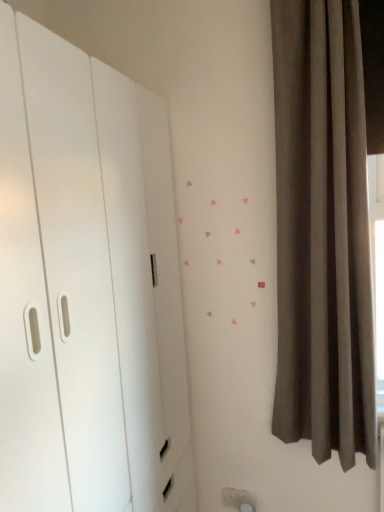
Question: Is white matte dresser at left taller than dark gray velvet curtain at right?

Choices:
 (A) yes
 (B) no

Answer: (A)

Question: Is the position of white matte dresser at left less distant than that of dark gray velvet curtain at right?

Choices:
 (A) yes
 (B) no

Answer: (A)

Question: Is white matte dresser at left looking in the opposite direction of dark gray velvet curtain at right?

Choices:
 (A) yes
 (B) no

Answer: (B)

Question: Does white matte dresser at left have a lesser height compared to dark gray velvet curtain at right?

Choices:
 (A) yes
 (B) no

Answer: (B)

Question: Would you say white matte dresser at left is outside dark gray velvet curtain at right?

Choices:
 (A) yes
 (B) no

Answer: (A)

Question: Can you confirm if white matte dresser at left is positioned to the right of dark gray velvet curtain at right?

Choices:
 (A) no
 (B) yes

Answer: (A)

Question: From the image's perspective, is dark gray velvet curtain at right on white matte dresser at left?

Choices:
 (A) yes
 (B) no

Answer: (A)

Question: Considering the relative sizes of dark gray velvet curtain at right and white matte dresser at left in the image provided, is dark gray velvet curtain at right taller than white matte dresser at left?

Choices:
 (A) yes
 (B) no

Answer: (B)

Question: Is dark gray velvet curtain at right wider than white matte dresser at left?

Choices:
 (A) yes
 (B) no

Answer: (B)

Question: Is the depth of dark gray velvet curtain at right less than that of white matte dresser at left?

Choices:
 (A) yes
 (B) no

Answer: (B)

Question: Can you see dark gray velvet curtain at right touching white matte dresser at left?

Choices:
 (A) yes
 (B) no

Answer: (B)

Question: Considering the relative sizes of dark gray velvet curtain at right and white matte dresser at left in the image provided, is dark gray velvet curtain at right thinner than white matte dresser at left?

Choices:
 (A) yes
 (B) no

Answer: (A)

Question: Does point (69, 178) appear closer or farther from the camera than point (306, 432)?

Choices:
 (A) closer
 (B) farther

Answer: (A)